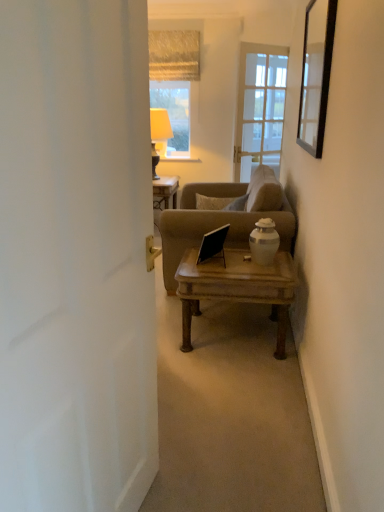
Question: Does wooden coffee table at center appear on the right side of textured beige curtain at upper center?

Choices:
 (A) no
 (B) yes

Answer: (B)

Question: From a real-world perspective, is wooden coffee table at center positioned under textured beige curtain at upper center based on gravity?

Choices:
 (A) no
 (B) yes

Answer: (B)

Question: Is wooden coffee table at center outside textured beige curtain at upper center?

Choices:
 (A) yes
 (B) no

Answer: (A)

Question: Is wooden coffee table at center shorter than textured beige curtain at upper center?

Choices:
 (A) no
 (B) yes

Answer: (B)

Question: From the image's perspective, is wooden coffee table at center on top of textured beige curtain at upper center?

Choices:
 (A) no
 (B) yes

Answer: (A)

Question: From the image's perspective, would you say wooden coffee table at center is shown under textured beige curtain at upper center?

Choices:
 (A) yes
 (B) no

Answer: (A)

Question: Is black glass mirror at upper right next to matte beige lampshade at upper center?

Choices:
 (A) yes
 (B) no

Answer: (B)

Question: Is black glass mirror at upper right at the right side of matte beige lampshade at upper center?

Choices:
 (A) yes
 (B) no

Answer: (A)

Question: Considering the relative sizes of black glass mirror at upper right and matte beige lampshade at upper center in the image provided, is black glass mirror at upper right thinner than matte beige lampshade at upper center?

Choices:
 (A) yes
 (B) no

Answer: (A)

Question: From a real-world perspective, is black glass mirror at upper right on top of matte beige lampshade at upper center?

Choices:
 (A) yes
 (B) no

Answer: (A)

Question: Can you confirm if black glass mirror at upper right is positioned to the left of matte beige lampshade at upper center?

Choices:
 (A) no
 (B) yes

Answer: (A)

Question: Does black glass mirror at upper right have a greater width compared to matte beige lampshade at upper center?

Choices:
 (A) yes
 (B) no

Answer: (B)

Question: Does matte beige lampshade at upper center come in front of white matte door at left?

Choices:
 (A) yes
 (B) no

Answer: (B)